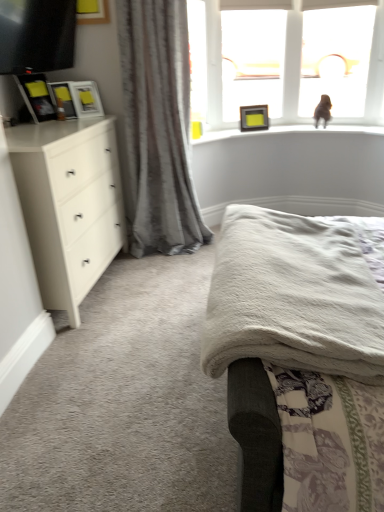
What are the coordinates of `vacant space situated on the left part of matte black picture frame at upper center, which is counted as the fourth picture frame, starting from the front` in the screenshot? It's located at (228, 133).